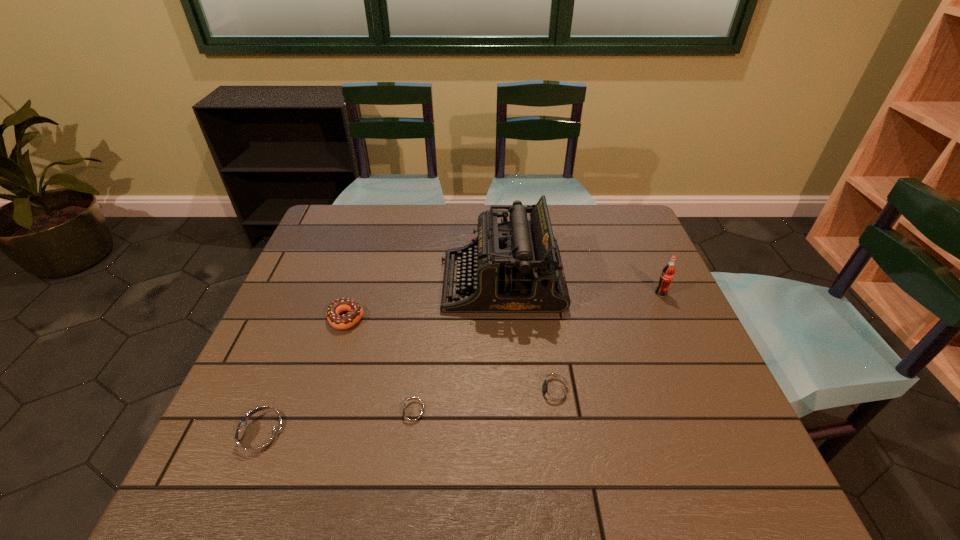
Locate an element on the screen. free point that keeps the watchs evenly spaced on the right is located at coordinates (685, 373).